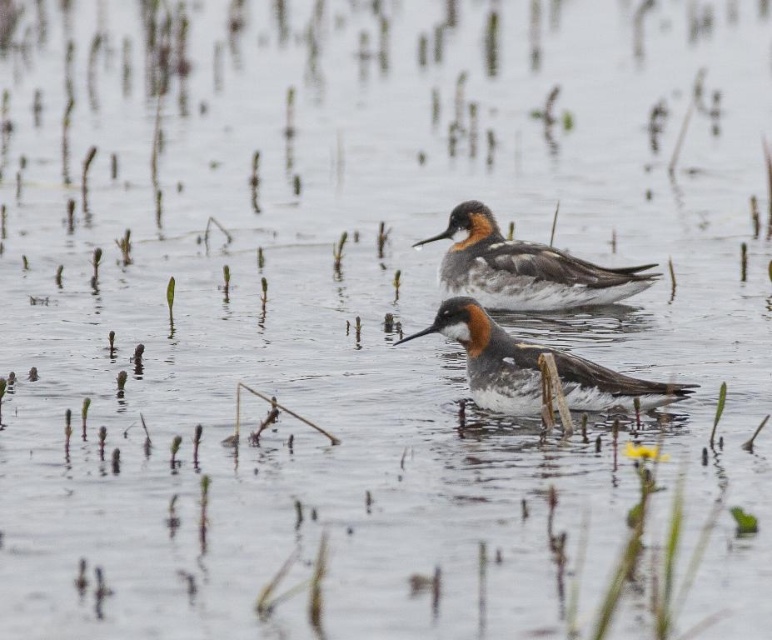
Between brown speckled duck at center and brown speckled feathers at center, which one has more height?

With more height is brown speckled duck at center.

Between brown speckled duck at center and brown speckled feathers at center, which one is positioned lower?

brown speckled feathers at center is below.

Is point (498, 244) positioned behind point (676, 387)?

That is True.

Image resolution: width=772 pixels, height=640 pixels. In order to click on brown speckled duck at center in this screenshot , I will do `click(523, 268)`.